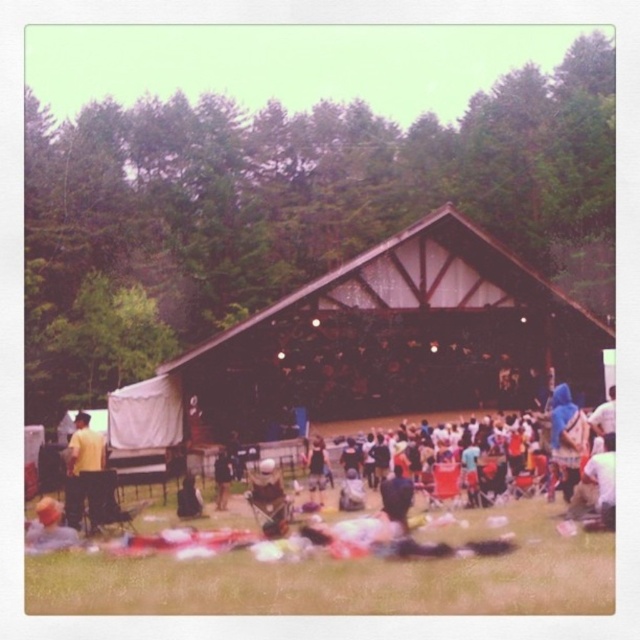
Can you confirm if yellow fabric at left is positioned to the right of blue fabric at right?

In fact, yellow fabric at left is to the left of blue fabric at right.

Based on the photo, is yellow fabric at left smaller than blue fabric at right?

Indeed, yellow fabric at left has a smaller size compared to blue fabric at right.

Which is in front, point (72, 460) or point (600, 435)?

Point (72, 460) is in front.

You are a GUI agent. You are given a task and a screenshot of the screen. Output one action in this format:
    pyautogui.click(x=<x>, y=<y>)
    Task: Click on the yellow fabric at left
    This screenshot has width=640, height=640.
    Given the screenshot: What is the action you would take?
    pyautogui.click(x=83, y=472)

Which of these two, blonde hair at lower left or blue fabric at right, stands taller?

With more height is blue fabric at right.

This screenshot has width=640, height=640. Find the location of `blonde hair at lower left`. blonde hair at lower left is located at coordinates (49, 529).

Where is `blonde hair at lower left`? blonde hair at lower left is located at coordinates (49, 529).

Is blonde hair at lower left to the left of dark brown leather jacket at center from the viewer's perspective?

Yes, blonde hair at lower left is to the left of dark brown leather jacket at center.

Is point (28, 548) positioned after point (224, 460)?

No, it is in front of (224, 460).

The image size is (640, 640). I want to click on blonde hair at lower left, so tap(49, 529).